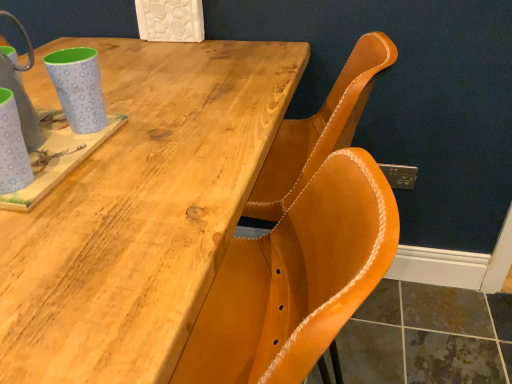
Image resolution: width=512 pixels, height=384 pixels. Describe the element at coordinates (78, 87) in the screenshot. I see `light blue polka dot mug at upper left, which ranks as the 2th mug in front-to-back order` at that location.

Where is `light blue polka dot mug at upper left, which ranks as the 2th mug in front-to-back order`? This screenshot has width=512, height=384. light blue polka dot mug at upper left, which ranks as the 2th mug in front-to-back order is located at coordinates (78, 87).

How many degrees apart are the facing directions of matte blue cup at left, which is the 2th mug from back to front, and light blue polka dot mug at upper left, which ranks as the 2th mug in front-to-back order?

The angle between the facing direction of matte blue cup at left, which is the 2th mug from back to front, and the facing direction of light blue polka dot mug at upper left, which ranks as the 2th mug in front-to-back order, is 0.00132 degrees.

In the image, is matte blue cup at left, acting as the 1th mug starting from the front, on the left side or the right side of light blue polka dot mug at upper left, placed as the first mug when sorted from back to front?

In the image, matte blue cup at left, acting as the 1th mug starting from the front, appears on the left side of light blue polka dot mug at upper left, placed as the first mug when sorted from back to front.

Does matte blue cup at left, which is the 2th mug from back to front, come behind light blue polka dot mug at upper left, placed as the first mug when sorted from back to front?

No, the depth of matte blue cup at left, which is the 2th mug from back to front, is less than that of light blue polka dot mug at upper left, placed as the first mug when sorted from back to front.

From a real-world perspective, between matte blue cup at left, which is the 2th mug from back to front, and light blue polka dot mug at upper left, placed as the first mug when sorted from back to front, who is vertically higher?

light blue polka dot mug at upper left, placed as the first mug when sorted from back to front, is physically above.

Considering the sizes of objects matte blue cup at left, which is the 2th mug from back to front, and natural wood table at upper left in the image provided, who is smaller, matte blue cup at left, which is the 2th mug from back to front, or natural wood table at upper left?

With smaller size is matte blue cup at left, which is the 2th mug from back to front.

From the image's perspective, who appears lower, matte blue cup at left, which is the 2th mug from back to front, or natural wood table at upper left?

natural wood table at upper left appears lower in the image.

Are matte blue cup at left, which is the 2th mug from back to front, and natural wood table at upper left beside each other?

There is a gap between matte blue cup at left, which is the 2th mug from back to front, and natural wood table at upper left.

You are a GUI agent. You are given a task and a screenshot of the screen. Output one action in this format:
    pyautogui.click(x=<x>, y=<y>)
    Task: Click on the table beneath the matte blue cup at left, acting as the 1th mug starting from the front (from a real-world perspective)
    
    Given the screenshot: What is the action you would take?
    pyautogui.click(x=139, y=209)

Which is behind, natural wood table at upper left or light blue polka dot mug at upper left, which ranks as the 2th mug in front-to-back order?

Positioned behind is light blue polka dot mug at upper left, which ranks as the 2th mug in front-to-back order.

Does point (118, 298) appear closer or farther from the camera than point (72, 81)?

Point (118, 298).

Is natural wood table at upper left wider than light blue polka dot mug at upper left, placed as the first mug when sorted from back to front?

Correct, the width of natural wood table at upper left exceeds that of light blue polka dot mug at upper left, placed as the first mug when sorted from back to front.

From a real-world perspective, is light blue polka dot mug at upper left, which ranks as the 2th mug in front-to-back order, physically below matte blue cup at left, which is the 2th mug from back to front?

No, from a real-world perspective, light blue polka dot mug at upper left, which ranks as the 2th mug in front-to-back order, is not below matte blue cup at left, which is the 2th mug from back to front.

Is point (86, 98) closer or farther from the camera than point (8, 173)?

Point (86, 98) appears to be farther away from the viewer than point (8, 173).

In terms of width, does light blue polka dot mug at upper left, which ranks as the 2th mug in front-to-back order, look wider or thinner when compared to matte blue cup at left, which is the 2th mug from back to front?

Considering their sizes, light blue polka dot mug at upper left, which ranks as the 2th mug in front-to-back order, looks broader than matte blue cup at left, which is the 2th mug from back to front.

Can you tell me how much light blue polka dot mug at upper left, which ranks as the 2th mug in front-to-back order, and matte blue cup at left, which is the 2th mug from back to front, differ in facing direction?

They differ by 0.00132 degrees in their facing directions.

Is natural wood table at upper left facing towards matte blue cup at left, acting as the 1th mug starting from the front?

No, natural wood table at upper left is not turned towards matte blue cup at left, acting as the 1th mug starting from the front.

Is natural wood table at upper left not inside matte blue cup at left, which is the 2th mug from back to front?

Yes, natural wood table at upper left is located beyond the bounds of matte blue cup at left, which is the 2th mug from back to front.

Considering the sizes of natural wood table at upper left and matte blue cup at left, acting as the 1th mug starting from the front, in the image, is natural wood table at upper left wider or thinner than matte blue cup at left, acting as the 1th mug starting from the front,?

In the image, natural wood table at upper left appears to be wider than matte blue cup at left, acting as the 1th mug starting from the front.

Is natural wood table at upper left directly adjacent to matte blue cup at left, acting as the 1th mug starting from the front?

There is a gap between natural wood table at upper left and matte blue cup at left, acting as the 1th mug starting from the front.

Could natural wood table at upper left be considered to be inside light blue polka dot mug at upper left, which ranks as the 2th mug in front-to-back order?

That's incorrect, natural wood table at upper left is not inside light blue polka dot mug at upper left, which ranks as the 2th mug in front-to-back order.

There is a natural wood table at upper left. Where is `the 2nd mug above it (from a real-world perspective)`? the 2nd mug above it (from a real-world perspective) is located at coordinates (78, 87).

From a real-world perspective, which object rests below the other?

natural wood table at upper left.

Measure the distance from light blue polka dot mug at upper left, placed as the first mug when sorted from back to front, to natural wood table at upper left.

The distance of light blue polka dot mug at upper left, placed as the first mug when sorted from back to front, from natural wood table at upper left is 8.90 inches.

This screenshot has width=512, height=384. In order to click on mug below the light blue polka dot mug at upper left, which ranks as the 2th mug in front-to-back order (from a real-world perspective) in this screenshot , I will do `click(12, 147)`.

Where is `table on the right of matte blue cup at left, acting as the 1th mug starting from the front`? table on the right of matte blue cup at left, acting as the 1th mug starting from the front is located at coordinates (139, 209).

Estimate the real-world distances between objects in this image. Which object is closer to matte blue cup at left, which is the 2th mug from back to front, natural wood table at upper left or light blue polka dot mug at upper left, which ranks as the 2th mug in front-to-back order?

light blue polka dot mug at upper left, which ranks as the 2th mug in front-to-back order, is positioned closer to the anchor matte blue cup at left, which is the 2th mug from back to front.

Based on their spatial positions, is matte blue cup at left, acting as the 1th mug starting from the front, or natural wood table at upper left further from light blue polka dot mug at upper left, which ranks as the 2th mug in front-to-back order?

natural wood table at upper left lies further to light blue polka dot mug at upper left, which ranks as the 2th mug in front-to-back order, than the other object.

Looking at the image, which one is located further to natural wood table at upper left, matte blue cup at left, acting as the 1th mug starting from the front, or light blue polka dot mug at upper left, placed as the first mug when sorted from back to front?

Among the two, matte blue cup at left, acting as the 1th mug starting from the front, is located further to natural wood table at upper left.

Based on their spatial positions, is light blue polka dot mug at upper left, which ranks as the 2th mug in front-to-back order, or natural wood table at upper left closer to matte blue cup at left, which is the 2th mug from back to front?

light blue polka dot mug at upper left, which ranks as the 2th mug in front-to-back order, is positioned closer to the anchor matte blue cup at left, which is the 2th mug from back to front.

When comparing their distances from light blue polka dot mug at upper left, placed as the first mug when sorted from back to front, does natural wood table at upper left or matte blue cup at left, which is the 2th mug from back to front, seem further?

The object further to light blue polka dot mug at upper left, placed as the first mug when sorted from back to front, is natural wood table at upper left.

Considering their positions, is light blue polka dot mug at upper left, which ranks as the 2th mug in front-to-back order, positioned further to natural wood table at upper left than matte blue cup at left, which is the 2th mug from back to front?

matte blue cup at left, which is the 2th mug from back to front.

Where is `mug between light blue polka dot mug at upper left, placed as the first mug when sorted from back to front, and natural wood table at upper left vertically`? This screenshot has width=512, height=384. mug between light blue polka dot mug at upper left, placed as the first mug when sorted from back to front, and natural wood table at upper left vertically is located at coordinates (12, 147).